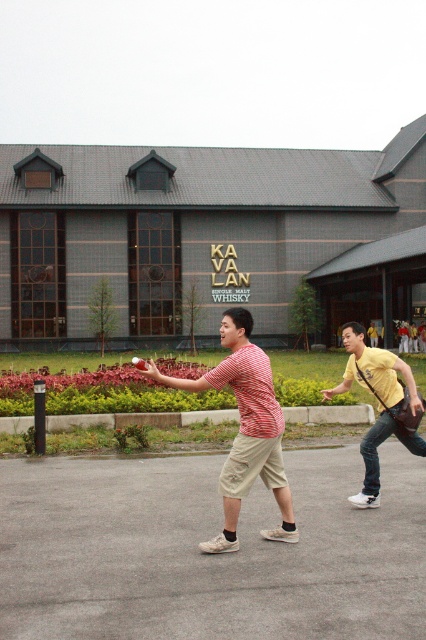
Looking at this image, you are a photographer trying to capture both the red striped shirt at center and the yellow cotton shirt at center in a single frame. Based on their sizes, which shirt should you focus on to ensure both fit comfortably in the photo without cropping?

The red striped shirt at center is wider than the yellow cotton shirt at center. To ensure both fit comfortably in the photo without cropping, focus on framing the wider red striped shirt at center first, then adjust the shot to include the narrower yellow cotton shirt at center.

Please provide the 2D coordinates of the gray brick building at center in the image. The coordinate system is normalized, where the origin is at the bottom left corner of the image, and the values range from 0 to 1 in both x and y axes.

The 2D coordinates of the gray brick building at center are at point 0.372 in the x axis and 0.486 in the y axis.